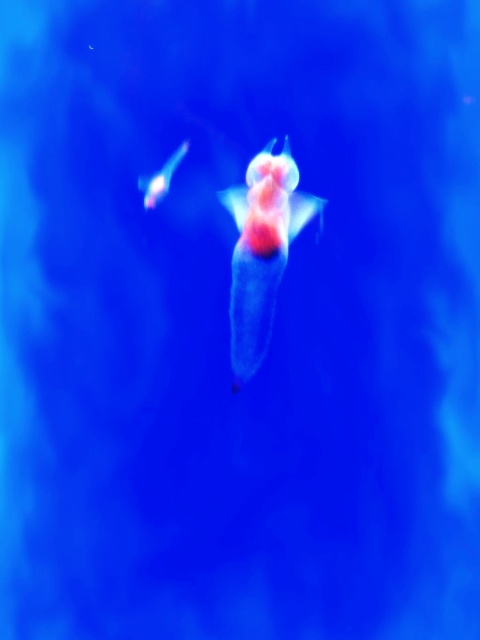
Is translucent blue fish at center positioned before matte pink fish at upper left?

Yes, translucent blue fish at center is closer to the viewer.

Is point (298, 225) closer to viewer compared to point (175, 168)?

No.

Is point (280, 211) in front of point (169, 177)?

That is True.

Find the location of a particular element. translucent blue fish at center is located at coordinates (262, 250).